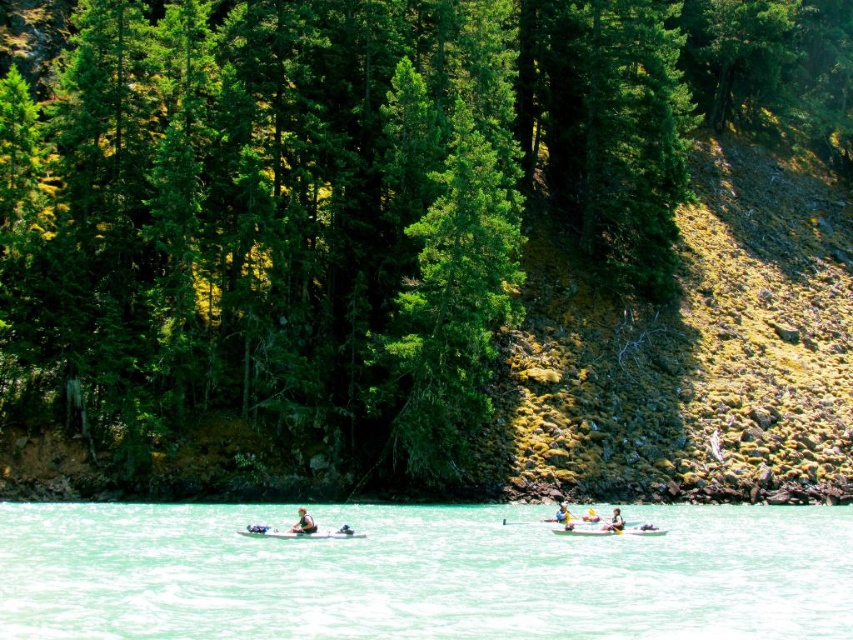
From the picture: You are standing at the origin point in the image and want to reach the point at the top of the frame. Which point should you head towards, point at point [769,531] or point [622,525]?

You should head towards point [769,531] because it is positioned behind point [622,525], meaning it is closer to the top of the frame.

You are a kayaker in the image and want to see the clear turquoise water at center. Which direction should you look relative to the light brown wooden paddle at center?

The clear turquoise water at center is in front of the light brown wooden wooden paddle at center, so you should look forward towards the direction the paddle is facing to see it.

You are a photographer positioned at point (x=299, y=532). You want to capture a photo of the matte white kayak at center. Is the matte white kayak at center within your current field of view?

The point (x=299, y=532) is where the matte white kayak at center is located, so yes, the matte white kayak at center is directly at your position and within your field of view.